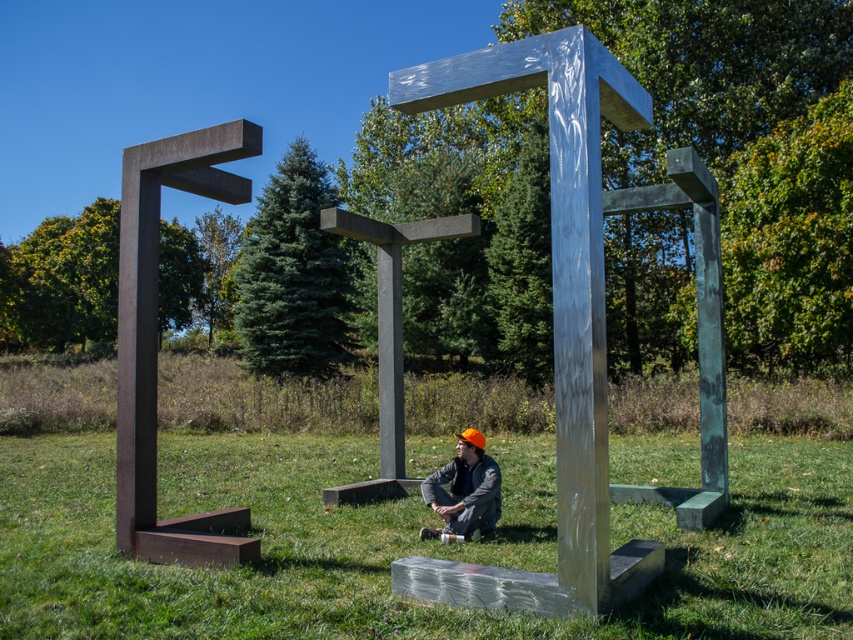
What are the coordinates of the green grass at center?

The coordinates of the green grass at center are at point [405,545].

Based on the photo, you are standing in the outdoor scene and want to place a small picnic basket between the green grass at center and the matte orange helmet at center. Based on their positions, which object should the basket be closer to?

The green grass at center is positioned on the right side of matte orange helmet at center, so the picnic basket should be placed closer to the matte orange helmet at center to be between them.

You are standing in the outdoor scene and want to place a 4 meter long ladder between you and the green grass at center. Is the distance sufficient to fit the ladder horizontally?

The distance between you and the green grass at center is 3.82 meters, which is slightly shorter than the 4 meter ladder. Therefore, the ladder cannot be placed horizontally between you and the green grass at center as there isn not enough space.